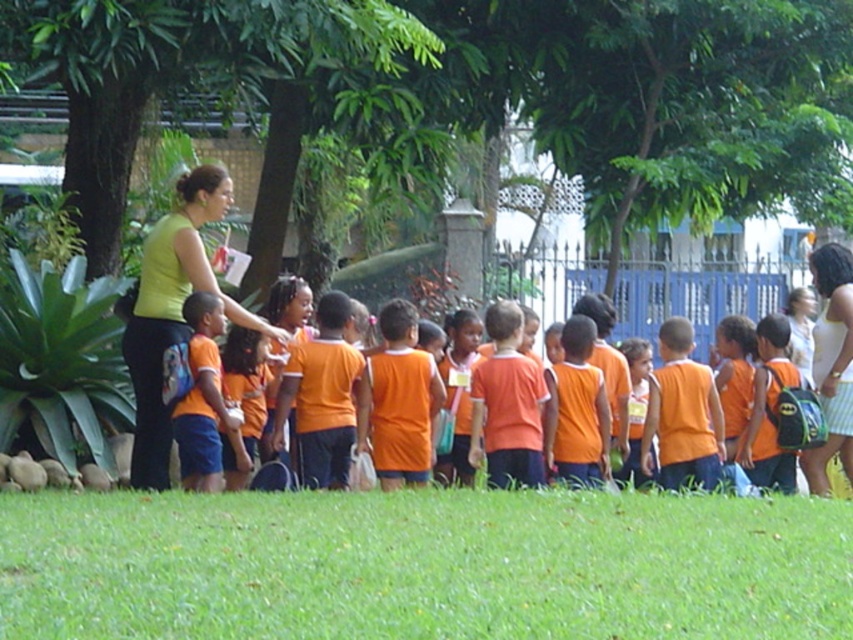
You are a photographer trying to capture a photo of the orange fabric shirt at left without the green leafy tree at upper center blocking the view. What should you do?

The green leafy tree at upper center is located above the orange fabric shirt at left, so you should lower your camera angle to avoid the tree blocking the view.

You are a photographer trying to capture a photo of the orange fabric shirt at left and the green leafy tree at upper center. Which object will appear bigger in your photo?

The green leafy tree at upper center will appear bigger in the photo because it is larger in size than the orange fabric shirt at left.

You are a photographer trying to capture a photo of the green leafy tree at upper center and the green matte shirt at upper left in the same frame. Based on their sizes in the image, which one would appear larger?

The green leafy tree at upper center appears larger than the green matte shirt at upper left because it is taller.